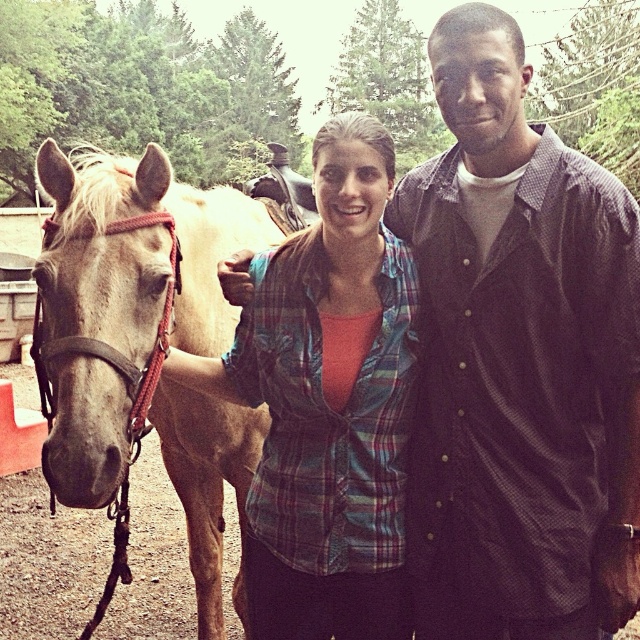
Can you confirm if dark brown button-up shirt at center-right is taller than plaid shirt at center?

Yes.

Between dark brown button-up shirt at center-right and plaid shirt at center, which one appears on the left side from the viewer's perspective?

plaid shirt at center is more to the left.

Is point (417, 220) behind point (248, 275)?

No, (417, 220) is in front of (248, 275).

The width and height of the screenshot is (640, 640). Find the location of `dark brown button-up shirt at center-right`. dark brown button-up shirt at center-right is located at coordinates (518, 362).

Is plaid shirt at center further to camera compared to light brown horse at left?

Yes, it is behind light brown horse at left.

Is plaid shirt at center wider than light brown horse at left?

Yes.

Describe the element at coordinates (326, 403) in the screenshot. Image resolution: width=640 pixels, height=640 pixels. I see `plaid shirt at center` at that location.

Image resolution: width=640 pixels, height=640 pixels. In order to click on plaid shirt at center in this screenshot , I will do `click(326, 403)`.

Which of these two, dark brown button-up shirt at center-right or light brown horse at left, stands taller?

Standing taller between the two is light brown horse at left.

What do you see at coordinates (518, 362) in the screenshot?
I see `dark brown button-up shirt at center-right` at bounding box center [518, 362].

Measure the distance between dark brown button-up shirt at center-right and camera.

5.99 feet

At what (x,y) coordinates should I click in order to perform the action: click on dark brown button-up shirt at center-right. Please return your answer as a coordinate pair (x, y). The image size is (640, 640). Looking at the image, I should click on (518, 362).